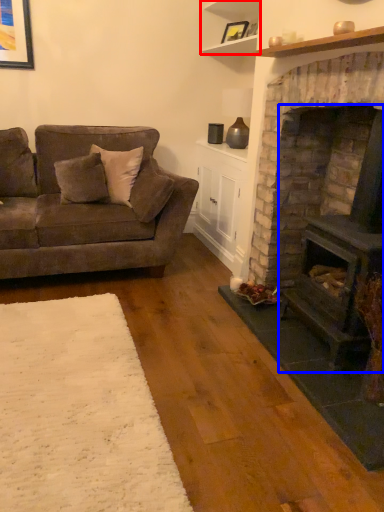
Question: Which point is further to the camera, shelf (highlighted by a red box) or wood burning stove (highlighted by a blue box)?

Choices:
 (A) shelf
 (B) wood burning stove

Answer: (A)